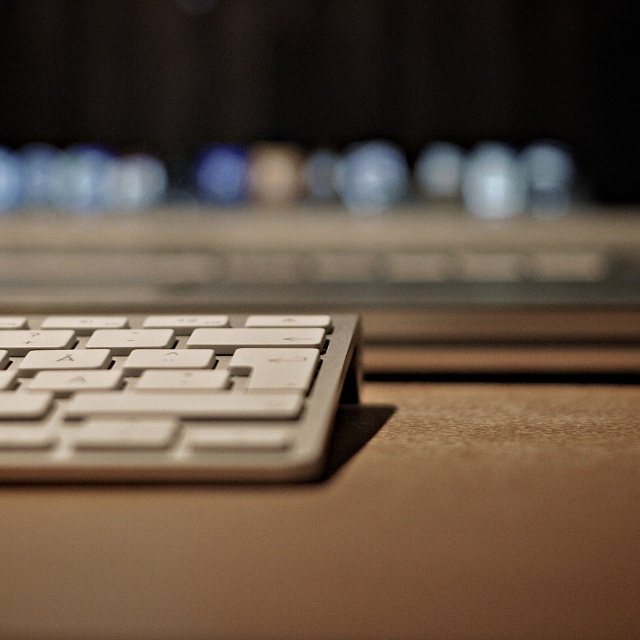
You are setting up a new workspace and want to place the white plastic keyboard at lower left on the white matte computer desk at lower center. Based on their heights, will the keyboard fit on the desk without hanging over the edge?

The white matte computer desk at lower center is not as tall as the white plastic keyboard at lower left, which means the desk is shorter in height. Therefore, the keyboard might not fit properly on the desk as it could potentially hang over the edges due to its greater height.

You are a delivery robot with a 4 inch wide package. You need to place the package on the white matte computer desk at lower center without moving the white plastic keyboard at lower left. Is there enough space between them?

The white matte computer desk at lower center and white plastic keyboard at lower left are 3.14 inches apart. Since the package is 4 inches wide, it is wider than the available space. Therefore, there is not enough space to place the package between them without moving the keyboard.

You are holding a 3D model of the keyboard and want to place a small sticker exactly at the point that corresponds to the point labeled as point (x=496, y=595) in the image. Given that the distance from your eyes to the point is 9.17 inches, can you estimate whether this point is on the keyboard or on the wooden surface below?

The point labeled point (x=496, y=595) is 9.17 inches away from the viewer. Since the keyboard is resting on the wooden surface, the wooden surface would be farther away. Therefore, the point is likely on the keyboard.